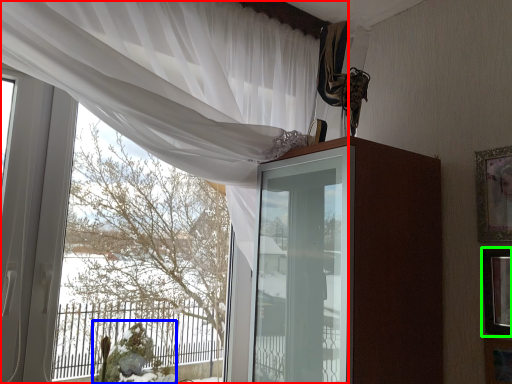
Question: Considering the real-world distances, which object is farthest from curtain (highlighted by a red box)? floral arrangement (highlighted by a blue box) or picture frame (highlighted by a green box)?

Choices:
 (A) floral arrangement
 (B) picture frame

Answer: (A)